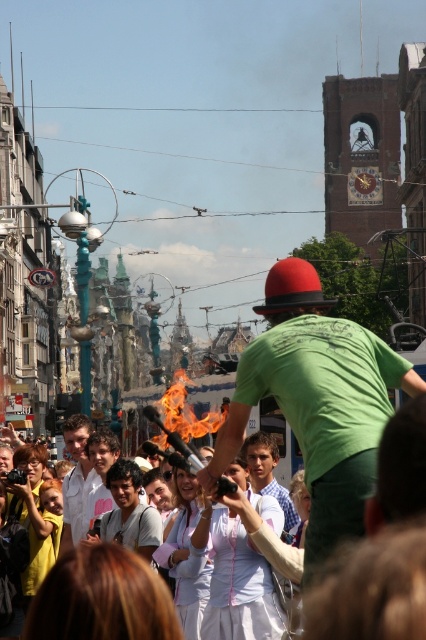
You are standing at the location of the viewer. You want to hand a water bottle to the person wearing the green matte shirt at center. The water bottle is 0.5 meters in length. Can you reach them with the bottle without moving from your current position?

The green matte shirt at center and viewer are 83.98 meters apart from each other. Since the water bottle is only 0.5 meters long, you cannot reach them without moving closer.

Based on the photo, you are standing at the center of the street and see the point marked at coordinates (75, 480). What object is located at that point?

The white shirt at center is located at the point marked at coordinates (75, 480).

You are a photographer standing at the edge of the crowd, wanting to capture a clear photo of the light blue shirt at center and the light brown hair at center. Since you want both subjects to be fully visible, which one should you focus on first to ensure it isn

The light blue shirt at center is not as tall as light brown hair at center, so you should focus on the light brown hair at center first to ensure it is fully visible in the photo.